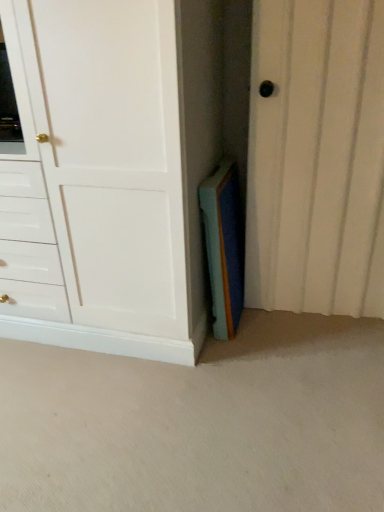
The image size is (384, 512). Identify the location of blue felt book at center. (224, 247).

Locate an element on the screen. This screenshot has height=512, width=384. white textured door at center is located at coordinates (316, 158).

I want to click on door behind the white matte cabinet at center, so click(316, 158).

Measure the distance between white matte cabinet at center and white textured door at center.

white matte cabinet at center is 61.72 centimeters away from white textured door at center.

Is white matte cabinet at center in front of white textured door at center?

Yes.

Would you say white matte cabinet at center is a long distance from white textured door at center?

No, there isn't a large distance between white matte cabinet at center and white textured door at center.

From the image's perspective, relative to white matte cabinet at center, is blue felt book at center above or below?

Clearly, from the image's perspective, blue felt book at center is below white matte cabinet at center.

Is blue felt book at center positioned far away from white matte cabinet at center?

No, blue felt book at center is in close proximity to white matte cabinet at center.

From a real-world perspective, who is located lower, blue felt book at center or white matte cabinet at center?

From a 3D spatial view, blue felt book at center is below.

This screenshot has height=512, width=384. I want to click on door on the right of blue felt book at center, so click(316, 158).

Is point (353, 147) farther from viewer compared to point (239, 301)?

No, (353, 147) is closer to viewer.

Is white textured door at center far from blue felt book at center?

Actually, white textured door at center and blue felt book at center are a little close together.

From a real-world perspective, which object rests below the other?

blue felt book at center.

Who is bigger, white matte cabinet at center or blue felt book at center?

With larger size is white matte cabinet at center.

Find the location of a particular element. the chest of drawers above the blue felt book at center (from the image's perspective) is located at coordinates (x=111, y=174).

Is white matte cabinet at center oriented away from blue felt book at center?

white matte cabinet at center is not turned away from blue felt book at center.

Can you tell me how much white matte cabinet at center and blue felt book at center differ in facing direction?

white matte cabinet at center and blue felt book at center are facing 90 degrees away from each other.

Is white matte cabinet at center a part of white textured door at center?

No, white matte cabinet at center is not a part of white textured door at center.

How different are the orientations of white textured door at center and white matte cabinet at center in degrees?

They differ by 4.56 degrees in their facing directions.

Which object is thinner, white textured door at center or white matte cabinet at center?

Thinner between the two is white textured door at center.

Considering the relative sizes of blue felt book at center and white textured door at center in the image provided, is blue felt book at center smaller than white textured door at center?

Indeed, blue felt book at center has a smaller size compared to white textured door at center.

Between blue felt book at center and white textured door at center, which one appears on the right side from the viewer's perspective?

Positioned to the right is white textured door at center.

Looking at this image, which is less distant, (227, 191) or (379, 181)?

Point (227, 191).

Is blue felt book at center far from white textured door at center?

No, blue felt book at center is not far from white textured door at center.

This screenshot has height=512, width=384. I want to click on the chest of drawers lying in front of the white textured door at center, so pyautogui.click(x=111, y=174).

Locate an element on the screen. chest of drawers above the blue felt book at center (from the image's perspective) is located at coordinates (111, 174).

Considering their positions, is white matte cabinet at center positioned closer to blue felt book at center than white textured door at center?

white textured door at center lies closer to blue felt book at center than the other object.

Which object lies further to the anchor point white textured door at center, blue felt book at center or white matte cabinet at center?

Among the two, white matte cabinet at center is located further to white textured door at center.

Based on their spatial positions, is white textured door at center or blue felt book at center closer to white matte cabinet at center?

blue felt book at center.

Considering their positions, is white textured door at center positioned closer to blue felt book at center than white matte cabinet at center?

Among the two, white textured door at center is located nearer to blue felt book at center.

Estimate the real-world distances between objects in this image. Which object is further from white textured door at center, white matte cabinet at center or blue felt book at center?

Among the two, white matte cabinet at center is located further to white textured door at center.

From the image, which object appears to be nearer to white matte cabinet at center, blue felt book at center or white textured door at center?

The object closer to white matte cabinet at center is blue felt book at center.

Locate an element on the screen. paperback book between white matte cabinet at center and white textured door at center is located at coordinates pos(224,247).